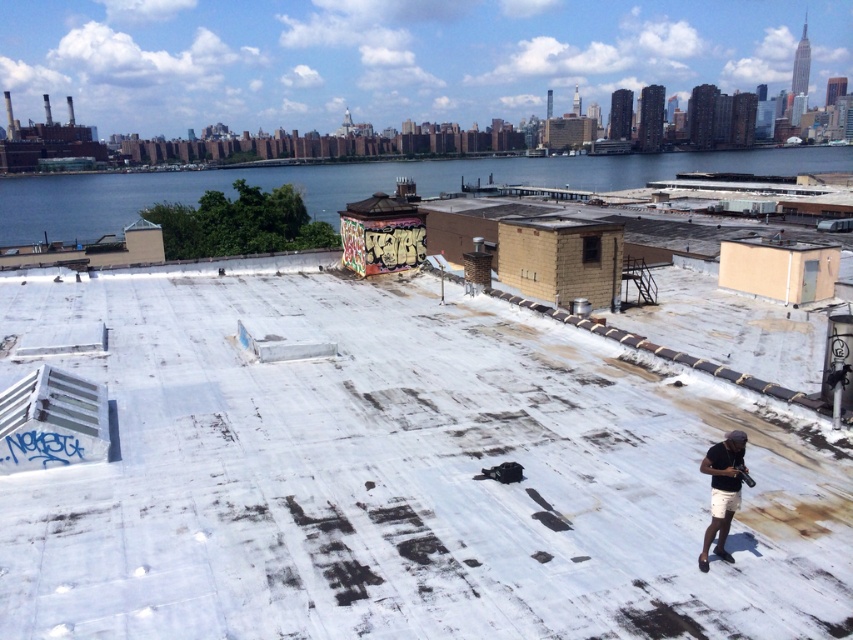
Based on the photo, you are standing on the rooftop and want to place a small potted plant between the white matte roof at center and the dark gray matte shorts at lower right. Which object should you place the plant closer to if you want it to be closer to the ground?

The dark gray matte shorts at lower right is closer to the ground, so you should place the plant closer to it.

Looking at this image, looking at the rooftop scene, where is the white matte roof at center in relation to the blue water at upper center?

The white matte roof at center is to the left of the blue water at upper center.